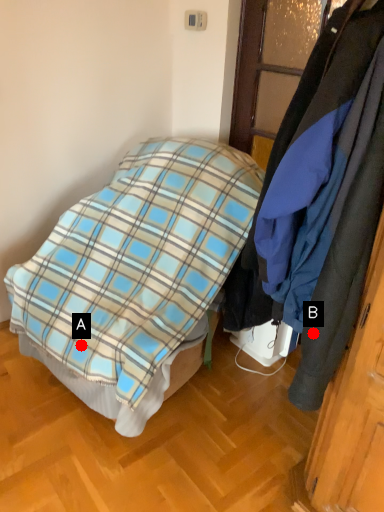
Question: Two points are circled on the image, labeled by A and B beside each circle. Which point is closer to the camera taking this photo?

Choices:
 (A) A is closer
 (B) B is closer

Answer: (B)